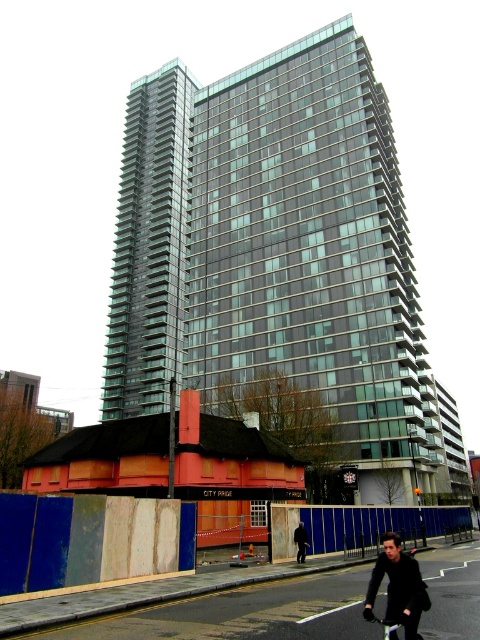
Can you confirm if glassy steel building at center is smaller than black matte bicycle at lower center?

No.

Can you confirm if glassy steel building at center is shorter than black matte bicycle at lower center?

No.

Where is `glassy steel building at center`? This screenshot has width=480, height=640. glassy steel building at center is located at coordinates (273, 250).

I want to click on dark blue jacket at lower right, so click(397, 586).

Does dark blue jacket at lower right have a greater width compared to black matte bicycle at lower center?

Indeed, dark blue jacket at lower right has a greater width compared to black matte bicycle at lower center.

Measure the distance between dark blue jacket at lower right and camera.

9.22 meters

The image size is (480, 640). I want to click on dark blue jacket at lower right, so click(397, 586).

Which is below, glassy steel building at center or dark brown leather jacket at lower center?

dark brown leather jacket at lower center is below.

Measure the distance between glassy steel building at center and camera.

glassy steel building at center is 65.75 meters from camera.

Image resolution: width=480 pixels, height=640 pixels. I want to click on glassy steel building at center, so click(x=273, y=250).